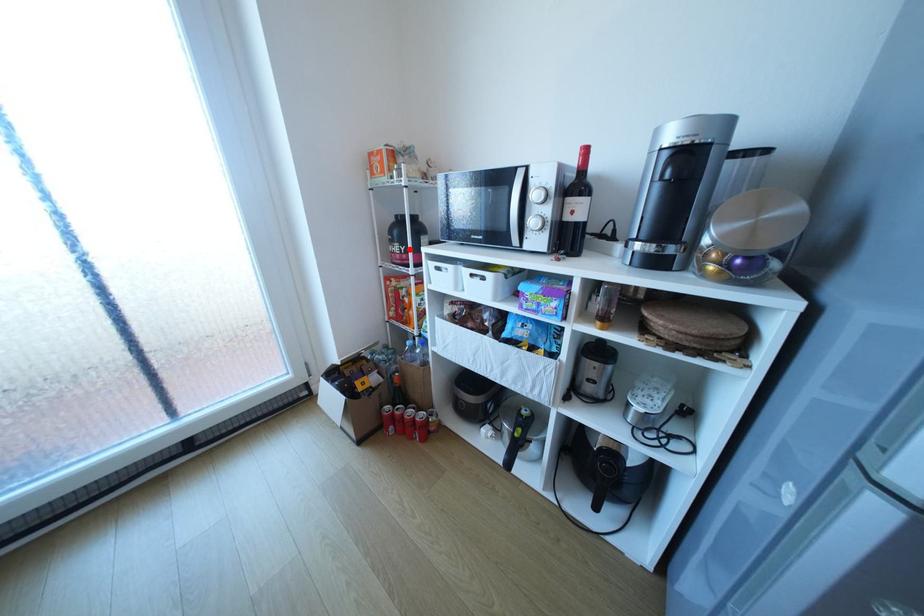
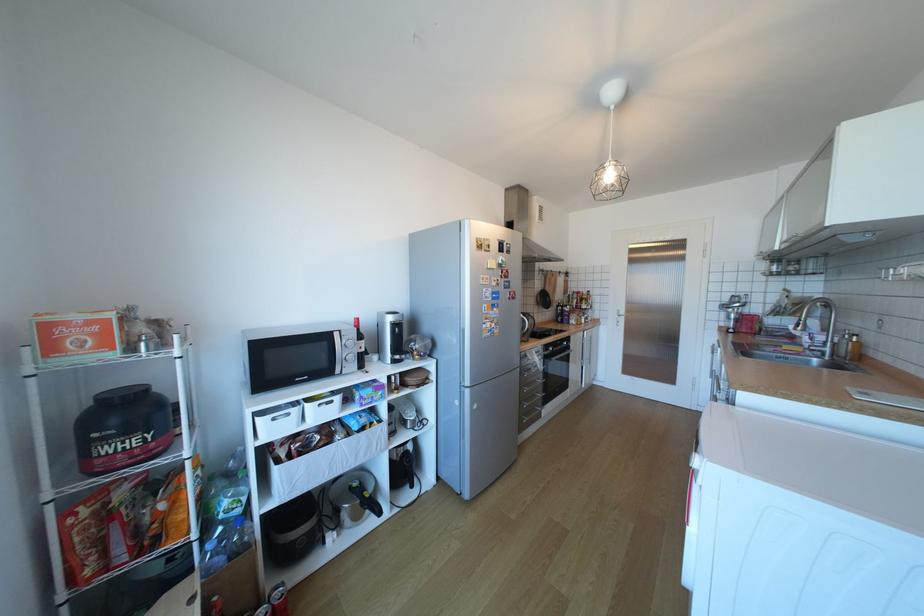
Where in the second image is the point corresponding to the highlighted location from the first image?

(152, 439)